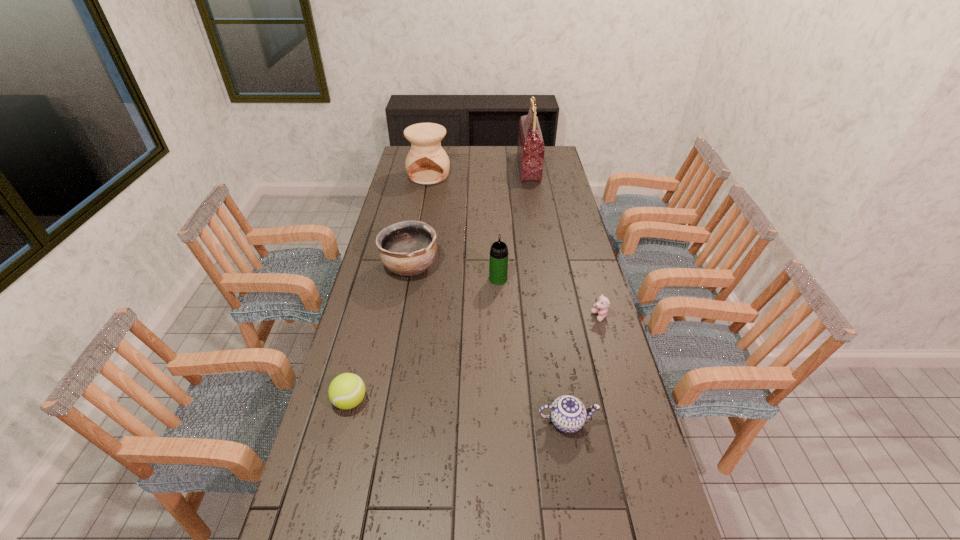
Find the location of a particular element. free space located at the spout of the chinaware is located at coordinates (635, 422).

This screenshot has height=540, width=960. I want to click on free spot located 0.290m at the face of the rightmost object, so click(509, 317).

Identify the location of free space located at the face of the rightmost object. (564, 317).

Find the location of a particular element. blank area located at the face of the rightmost object is located at coordinates coord(515,317).

I want to click on handbag located at the far edge, so click(530, 150).

At what (x,y) coordinates should I click in order to perform the action: click on pottery present at the far edge. Please return your answer as a coordinate pair (x, y). This screenshot has height=540, width=960. Looking at the image, I should click on (427, 163).

You are a GUI agent. You are given a task and a screenshot of the screen. Output one action in this format:
    pyautogui.click(x=<x>, y=<y>)
    Task: Click on the tennis ball present at the left edge
    The image size is (960, 540).
    Given the screenshot: What is the action you would take?
    pyautogui.click(x=347, y=390)

This screenshot has height=540, width=960. I want to click on handbag present at the right edge, so click(530, 150).

At what (x,y) coordinates should I click in order to perform the action: click on chinaware that is positioned at the right edge. Please return your answer as a coordinate pair (x, y). Image resolution: width=960 pixels, height=540 pixels. Looking at the image, I should click on (568, 414).

Find the location of `teddy bear at the right edge`. teddy bear at the right edge is located at coordinates (601, 307).